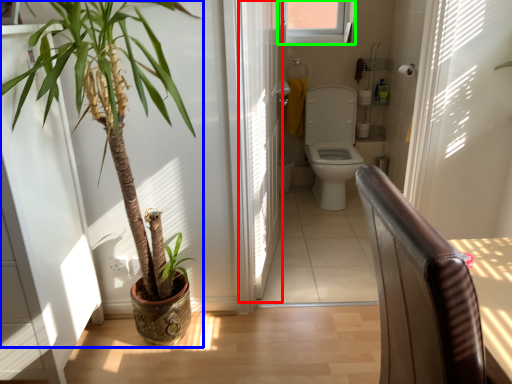
Question: Estimate the real-world distances between objects in this image. Which object is closer to screen door (highlighted by a red box), houseplant (highlighted by a blue box) or window (highlighted by a green box)?

Choices:
 (A) houseplant
 (B) window

Answer: (A)